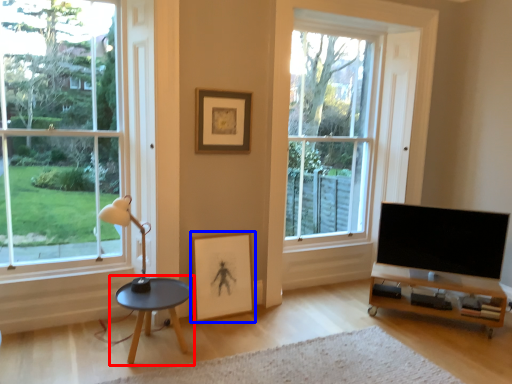
Question: Which of the following is the farthest to the observer, coffee table (highlighted by a red box) or picture frame (highlighted by a blue box)?

Choices:
 (A) coffee table
 (B) picture frame

Answer: (B)